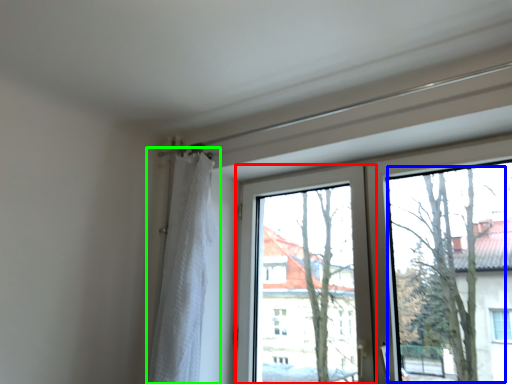
Question: Which is farther away from window screen (highlighted by a red box)? tree (highlighted by a blue box) or curtain (highlighted by a green box)?

Choices:
 (A) tree
 (B) curtain

Answer: (B)